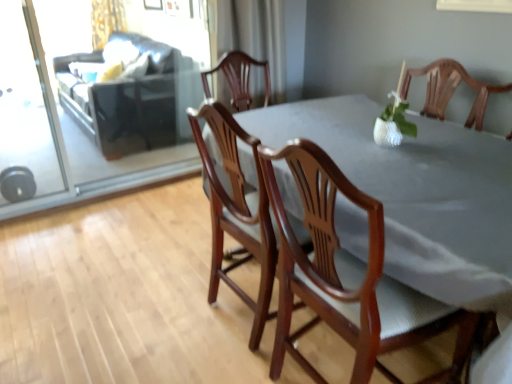
Question: From a real-world perspective, is white sheer curtain at upper center, acting as the 2th curtain starting from the top, physically below wooden table at center?

Choices:
 (A) yes
 (B) no

Answer: (B)

Question: From a real-world perspective, is white sheer curtain at upper center, acting as the 2th curtain starting from the top, located higher than wooden table at center?

Choices:
 (A) no
 (B) yes

Answer: (B)

Question: Is wooden table at center completely or partially inside white sheer curtain at upper center, arranged as the 1th curtain when ordered from the bottom?

Choices:
 (A) yes
 (B) no

Answer: (B)

Question: Considering the relative sizes of white sheer curtain at upper center, which ranks as the first curtain in front-to-back order, and wooden table at center in the image provided, is white sheer curtain at upper center, which ranks as the first curtain in front-to-back order, wider than wooden table at center?

Choices:
 (A) yes
 (B) no

Answer: (B)

Question: Is white sheer curtain at upper center, acting as the 2th curtain starting from the top, looking in the opposite direction of wooden table at center?

Choices:
 (A) no
 (B) yes

Answer: (A)

Question: Considering the relative sizes of white sheer curtain at upper center, which is the 1th curtain in right-to-left order, and wooden table at center in the image provided, is white sheer curtain at upper center, which is the 1th curtain in right-to-left order, taller than wooden table at center?

Choices:
 (A) yes
 (B) no

Answer: (B)

Question: Considering the relative sizes of white sheer curtain at upper center, acting as the 2th curtain starting from the top, and transparent glass screen door at upper left, the first screen door in the right-to-left sequence, in the image provided, is white sheer curtain at upper center, acting as the 2th curtain starting from the top, taller than transparent glass screen door at upper left, the first screen door in the right-to-left sequence,?

Choices:
 (A) yes
 (B) no

Answer: (B)

Question: Would you say white sheer curtain at upper center, arranged as the 1th curtain when ordered from the bottom, is a long distance from transparent glass screen door at upper left, acting as the 2th screen door starting from the left?

Choices:
 (A) yes
 (B) no

Answer: (A)

Question: Is white sheer curtain at upper center, which is the 2th curtain in back-to-front order, directly adjacent to transparent glass screen door at upper left, acting as the 2th screen door starting from the left?

Choices:
 (A) no
 (B) yes

Answer: (A)

Question: Is white sheer curtain at upper center, which is the 1th curtain in right-to-left order, outside of transparent glass screen door at upper left, the first screen door in the right-to-left sequence?

Choices:
 (A) yes
 (B) no

Answer: (A)

Question: Is white sheer curtain at upper center, which ranks as the first curtain in front-to-back order, at the left side of transparent glass screen door at upper left, acting as the 2th screen door starting from the left?

Choices:
 (A) no
 (B) yes

Answer: (A)

Question: Does white sheer curtain at upper center, which ranks as the first curtain in front-to-back order, have a greater width compared to transparent glass screen door at upper left, acting as the 2th screen door starting from the left?

Choices:
 (A) no
 (B) yes

Answer: (B)

Question: From a real-world perspective, does wooden table at center sit lower than wooden chair at center, which is the 2th chair in right-to-left order?

Choices:
 (A) no
 (B) yes

Answer: (B)